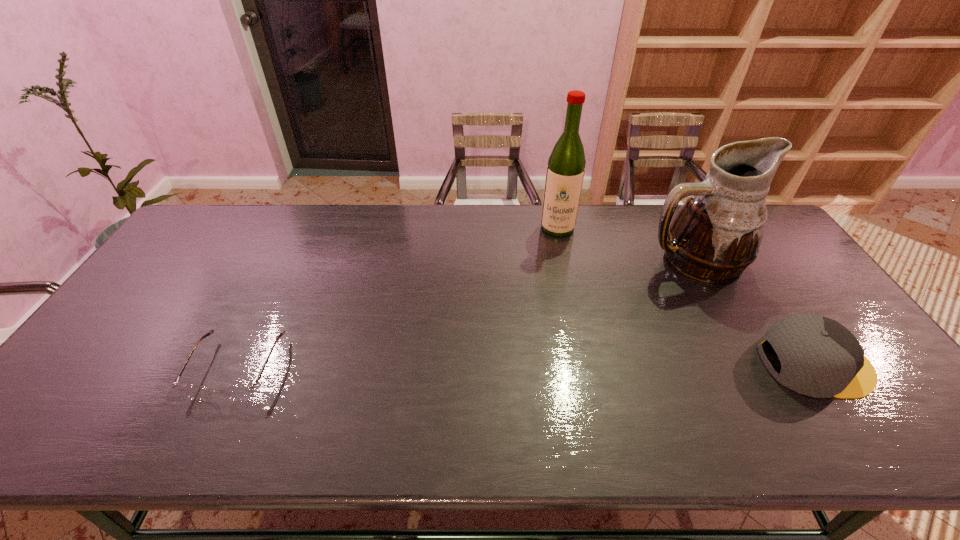
Identify the location of vacant region located 0.360m from the spout of the pitcher. The height and width of the screenshot is (540, 960). (610, 357).

You are a GUI agent. You are given a task and a screenshot of the screen. Output one action in this format:
    pyautogui.click(x=<x>, y=<y>)
    Task: Click on the liquor that is positioned at the far edge
    
    Given the screenshot: What is the action you would take?
    pyautogui.click(x=565, y=171)

Locate an element on the screen. This screenshot has width=960, height=540. pitcher positioned at the far edge is located at coordinates (716, 234).

At what (x,y) coordinates should I click in order to perform the action: click on spectacles present at the near edge. Please return your answer as a coordinate pair (x, y). Image resolution: width=960 pixels, height=540 pixels. Looking at the image, I should click on (236, 392).

Find the location of a particular element. This screenshot has height=540, width=960. cap located at the near edge is located at coordinates coord(820,358).

Where is `object at the right edge`? object at the right edge is located at coordinates (820, 358).

Where is `object that is positioned at the near right corner`? The height and width of the screenshot is (540, 960). object that is positioned at the near right corner is located at coordinates (820, 358).

At what (x,y) coordinates should I click in order to perform the action: click on blank space at the far edge of the desktop. Please return your answer as a coordinate pair (x, y). The image size is (960, 540). Looking at the image, I should click on coord(394,207).

Find the location of a particular element. The width and height of the screenshot is (960, 540). vacant region at the near edge of the desktop is located at coordinates (519, 376).

Locate an element on the screen. The width and height of the screenshot is (960, 540). vacant space at the left edge of the desktop is located at coordinates (131, 305).